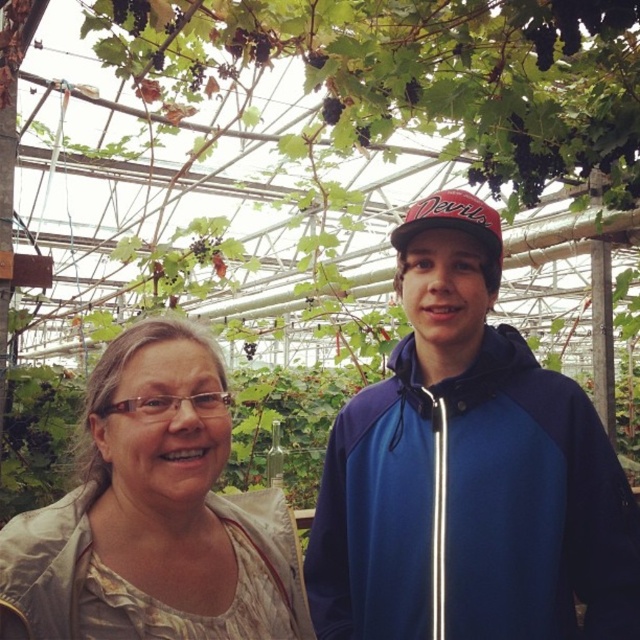
You are a photographer standing at the center of the greenhouse. You want to take a photo of the two people so that they both are in focus. The light beige fabric at center is between them. How far apart should you position them to ensure both are in focus?

The two people should be positioned 3.63 feet apart to ensure both are in focus since that is the distance between them as described.

You are a photographer trying to capture a clear photo of the light beige fabric at center and the red fabric baseball cap at center. Which one is closer to the camera?

The light beige fabric at center is closer to the camera because it is in front of the red fabric baseball cap at center.